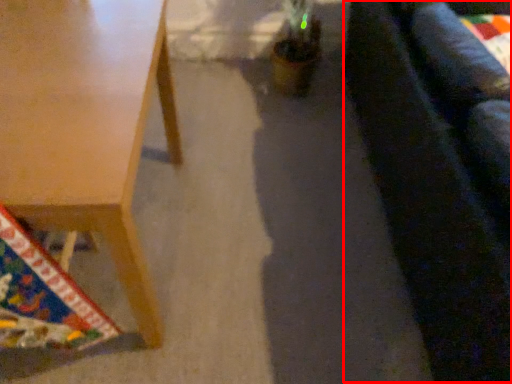
Question: Observing the image, what is the correct spatial positioning of couch (annotated by the red box) in reference to table?

Choices:
 (A) left
 (B) right

Answer: (B)